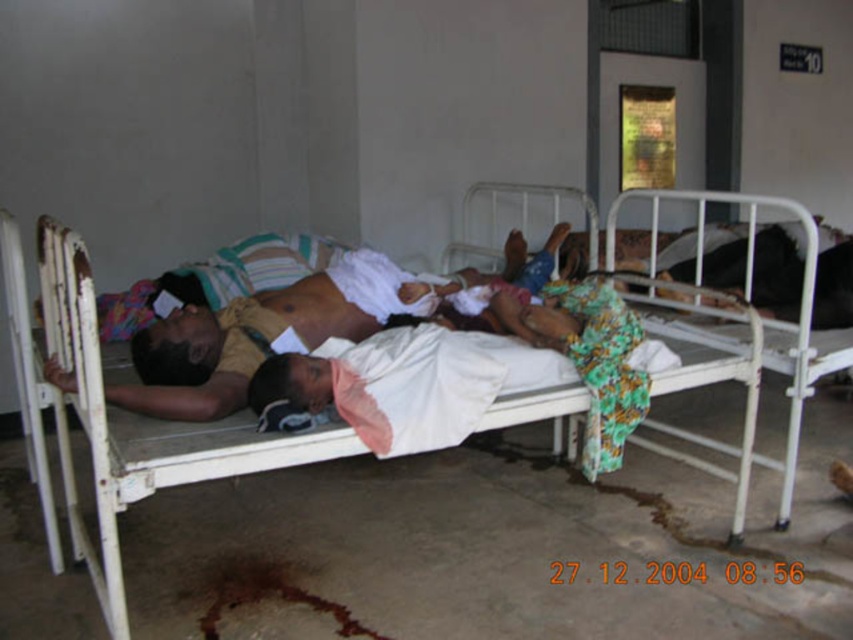
This screenshot has height=640, width=853. What do you see at coordinates (138, 428) in the screenshot?
I see `white metal bed at center` at bounding box center [138, 428].

Which of these two, white metal bed at center or light brown fabric shirt at center, stands taller?

white metal bed at center

What do you see at coordinates (138, 428) in the screenshot? The width and height of the screenshot is (853, 640). I see `white metal bed at center` at bounding box center [138, 428].

Where is `white metal bed at center`? This screenshot has width=853, height=640. white metal bed at center is located at coordinates (138, 428).